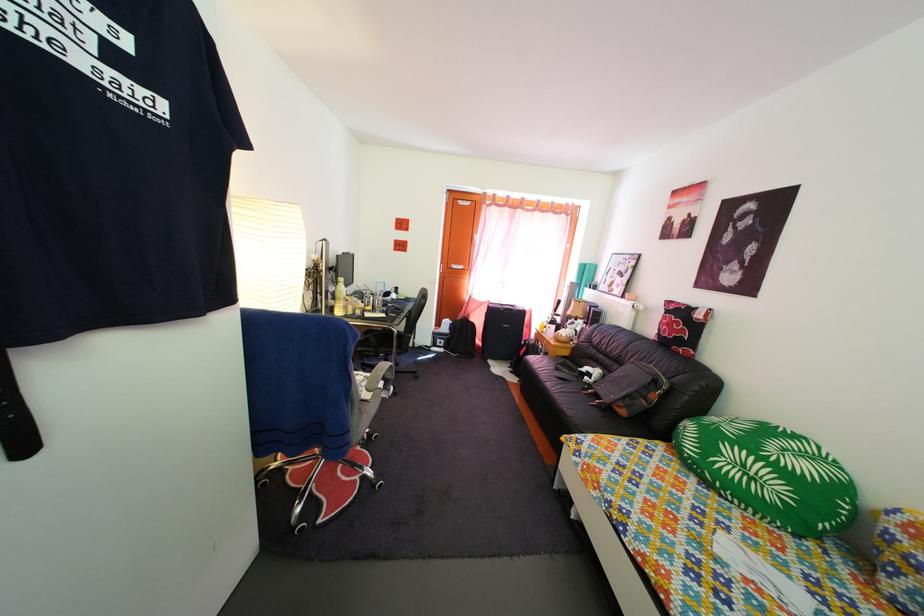
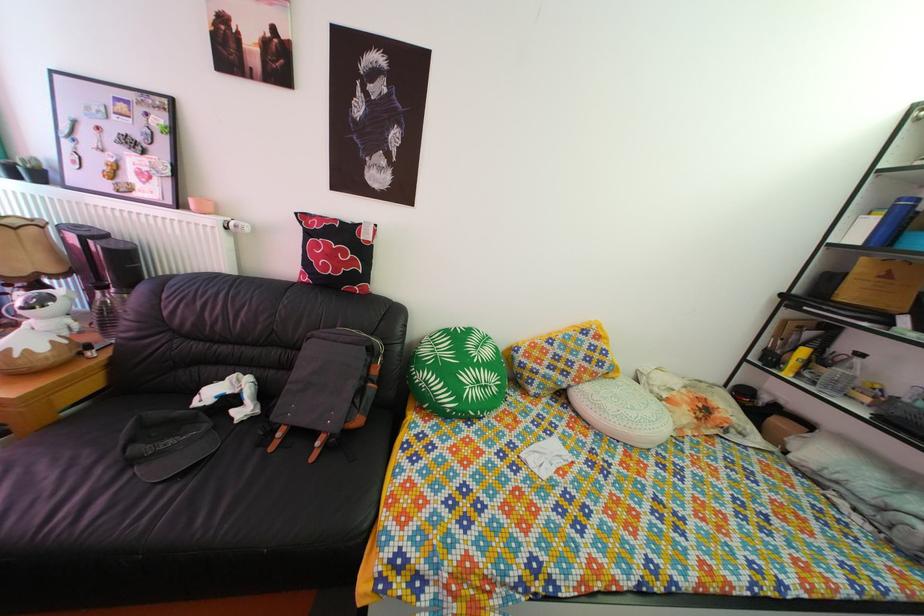
The point at (578, 371) is marked in the first image. Where is the corresponding point in the second image?

(166, 422)